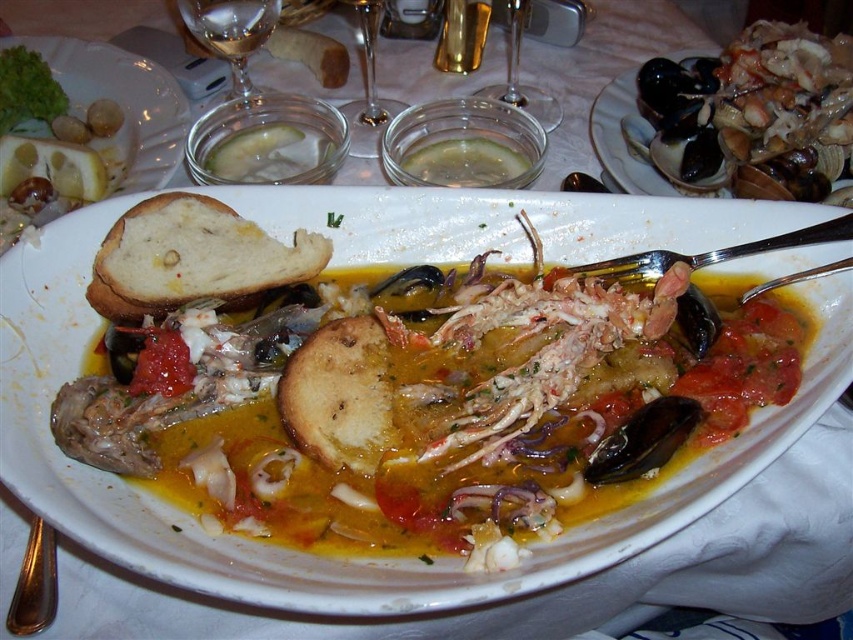
Question: Which point is farther to the camera?

Choices:
 (A) clear glass wine at upper center
 (B) clear glass wine glass at upper center
 (C) clear glass bowl at upper center

Answer: (A)

Question: Observing the image, what is the correct spatial positioning of white bread at upper left in reference to shiny metallic spoon at lower left?

Choices:
 (A) left
 (B) right

Answer: (A)

Question: Does clear glass wine at upper center have a smaller size compared to shiny metallic spoon at lower left?

Choices:
 (A) yes
 (B) no

Answer: (B)

Question: Which object is the closest to the white matte plate at center?

Choices:
 (A) transparent glass at upper center
 (B) clear glass wine at upper center
 (C) white soft bread at center
 (D) transparent glass wine glass at center

Answer: (C)

Question: Does clear glass bowl at upper center have a smaller size compared to transparent glass at upper center?

Choices:
 (A) no
 (B) yes

Answer: (B)

Question: Which of the following is the closest to the observer?

Choices:
 (A) click(x=648, y=552)
 (B) click(x=213, y=36)
 (C) click(x=515, y=0)
 (D) click(x=292, y=397)

Answer: (A)